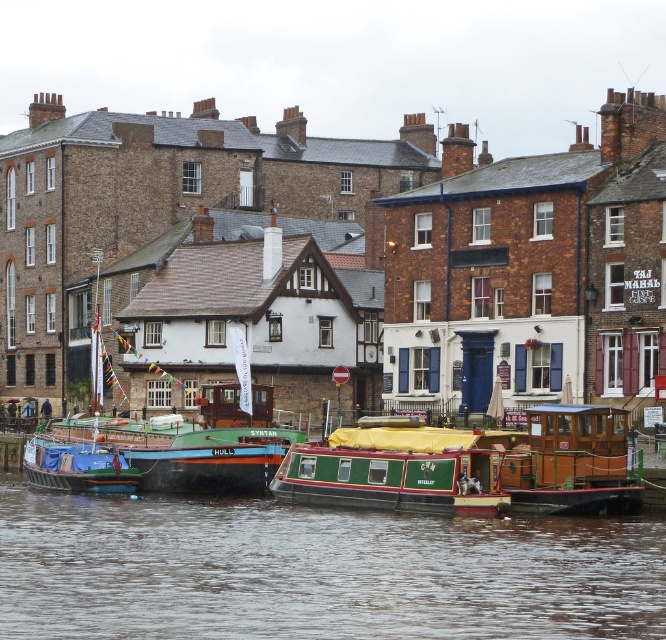
Does point (328, 458) come farther from viewer compared to point (585, 408)?

Yes.

Is green wooden boat at center to the left of wooden cabin cruiser at center from the viewer's perspective?

Correct, you'll find green wooden boat at center to the left of wooden cabin cruiser at center.

The image size is (666, 640). Find the location of `green wooden boat at center`. green wooden boat at center is located at coordinates (396, 470).

The height and width of the screenshot is (640, 666). Find the location of `green wooden boat at center`. green wooden boat at center is located at coordinates (396, 470).

Where is `green painted wooden boat at lower center`? green painted wooden boat at lower center is located at coordinates (316, 570).

What do you see at coordinates (316, 570) in the screenshot? Image resolution: width=666 pixels, height=640 pixels. I see `green painted wooden boat at lower center` at bounding box center [316, 570].

Between point (500, 620) and point (563, 464), which one is positioned in front?

Point (500, 620) is more forward.

Find the location of a particular element. The image size is (666, 640). green painted wooden boat at lower center is located at coordinates (316, 570).

Does green painted wooden boat at lower center appear on the left side of green wooden boat at center?

Correct, you'll find green painted wooden boat at lower center to the left of green wooden boat at center.

Does green painted wooden boat at lower center have a greater height compared to green wooden boat at center?

No, green painted wooden boat at lower center is not taller than green wooden boat at center.

Is point (127, 588) farther from camera compared to point (446, 488)?

No.

Identify the location of green painted wooden boat at lower center. (316, 570).